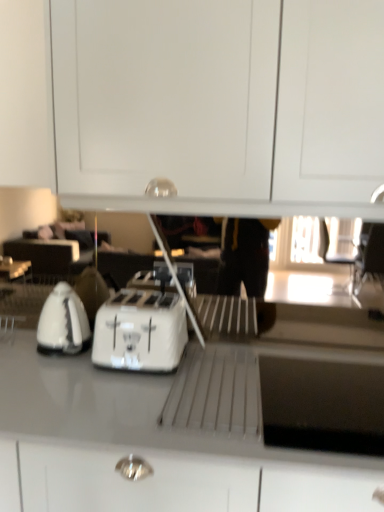
I want to click on vacant area that is in front of white plastic toaster at center, so click(x=104, y=394).